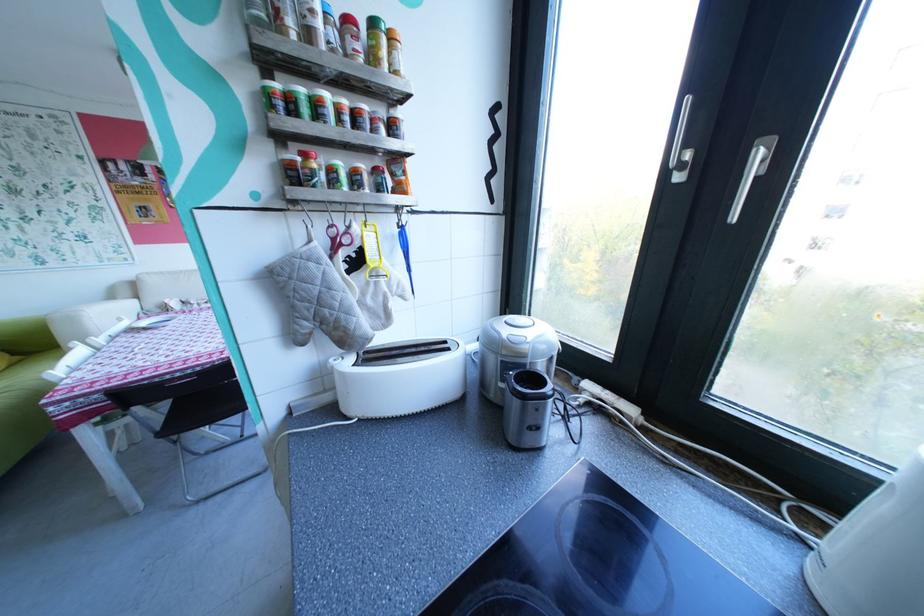
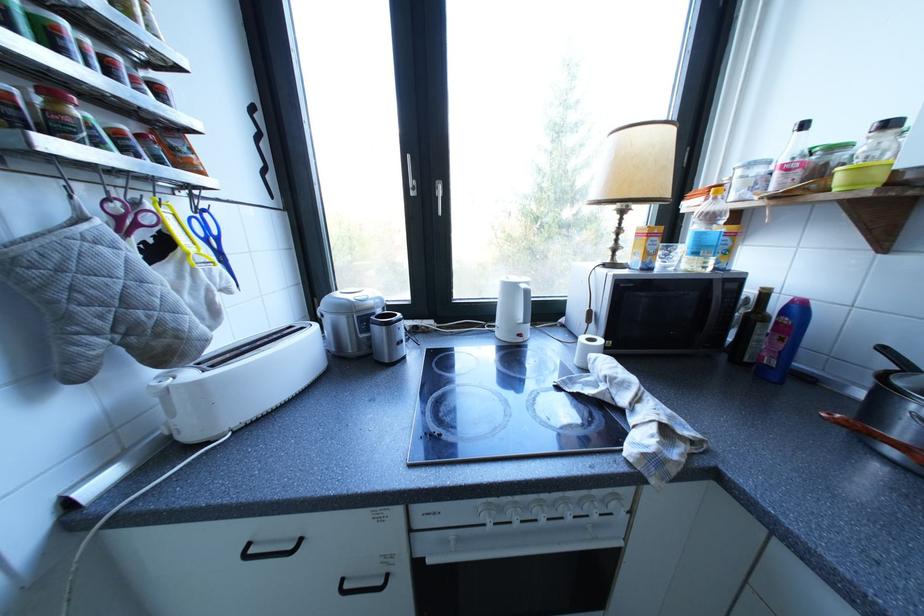
In the second image, find the point that corresponds to point (346, 368) in the first image.

(179, 387)